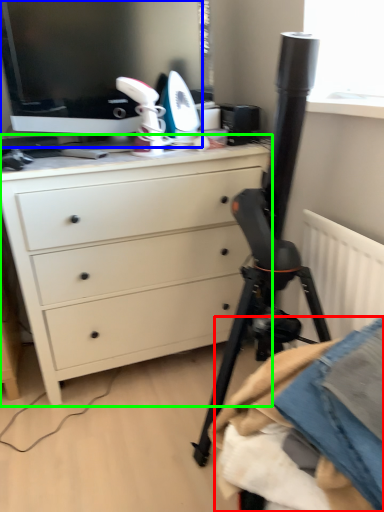
Question: Based on their relative distances, which object is farther from clothing (highlighted by a red box)? Choose from computer monitor (highlighted by a blue box) and chest of drawers (highlighted by a green box).

Choices:
 (A) computer monitor
 (B) chest of drawers

Answer: (A)